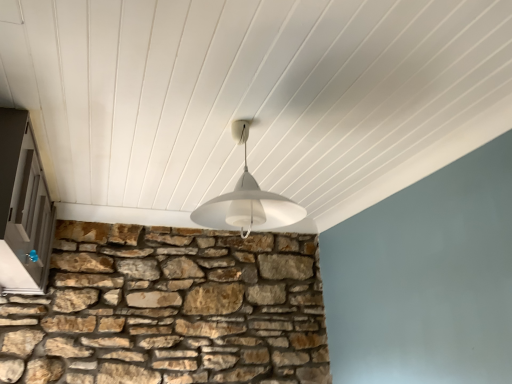
Question: Should I look upward or downward to see matte gray door at left?

Choices:
 (A) down
 (B) up

Answer: (A)

Question: Considering the relative positions of white matte lampshade at center and matte gray door at left in the image provided, is white matte lampshade at center behind matte gray door at left?

Choices:
 (A) yes
 (B) no

Answer: (A)

Question: Is white matte lampshade at center shorter than matte gray door at left?

Choices:
 (A) yes
 (B) no

Answer: (A)

Question: Are white matte lampshade at center and matte gray door at left far apart?

Choices:
 (A) no
 (B) yes

Answer: (A)

Question: Is white matte lampshade at center turned away from matte gray door at left?

Choices:
 (A) no
 (B) yes

Answer: (A)

Question: From a real-world perspective, is white matte lampshade at center under matte gray door at left?

Choices:
 (A) yes
 (B) no

Answer: (B)

Question: From a real-world perspective, is white matte lampshade at center located higher than matte gray door at left?

Choices:
 (A) yes
 (B) no

Answer: (A)

Question: Does matte gray door at left have a greater width compared to white matte lampshade at center?

Choices:
 (A) yes
 (B) no

Answer: (B)

Question: Is matte gray door at left not inside white matte lampshade at center?

Choices:
 (A) yes
 (B) no

Answer: (A)

Question: Would you say white matte lampshade at center is part of matte gray door at left's contents?

Choices:
 (A) no
 (B) yes

Answer: (A)

Question: From a real-world perspective, is matte gray door at left on white matte lampshade at center?

Choices:
 (A) yes
 (B) no

Answer: (B)

Question: Is matte gray door at left bigger than white matte lampshade at center?

Choices:
 (A) yes
 (B) no

Answer: (A)

Question: Can you confirm if matte gray door at left is smaller than white matte lampshade at center?

Choices:
 (A) yes
 (B) no

Answer: (B)

Question: Is point (24, 228) positioned closer to the camera than point (245, 173)?

Choices:
 (A) farther
 (B) closer

Answer: (B)